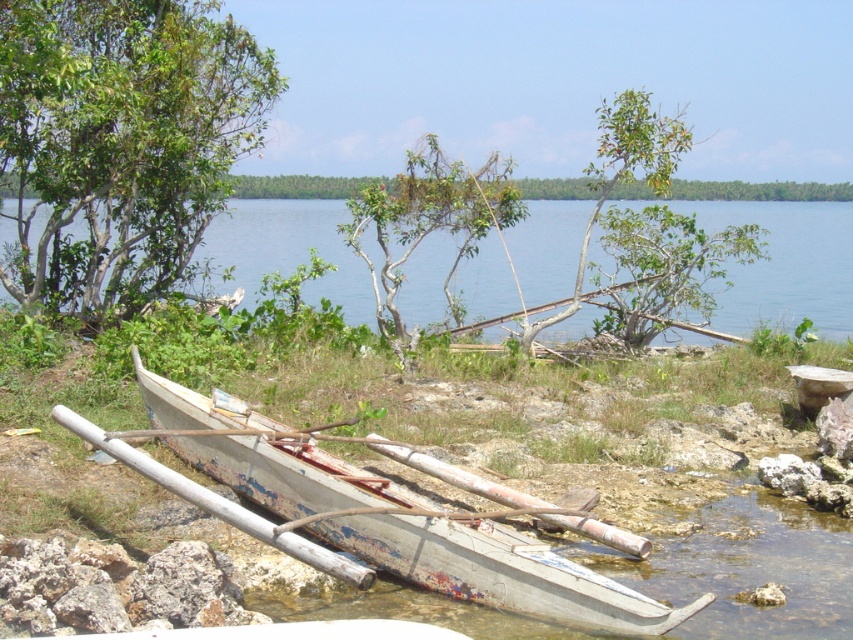
Question: Which point appears closest to the camera in this image?

Choices:
 (A) (96, 97)
 (B) (244, 275)

Answer: (A)

Question: From the image, what is the correct spatial relationship of green leafy tree at upper left in relation to blue water at center?

Choices:
 (A) right
 (B) left

Answer: (B)

Question: Estimate the real-world distances between objects in this image. Which object is closer to the white wooden boat at lower center?

Choices:
 (A) green leafy tree at center
 (B) green leafy tree at upper left

Answer: (B)

Question: Does green leafy tree at upper left have a greater width compared to green leafy tree at center?

Choices:
 (A) no
 (B) yes

Answer: (B)

Question: Is blue water at center in front of white wooden boat at lower center?

Choices:
 (A) yes
 (B) no

Answer: (B)

Question: Among these objects, which one is farthest from the camera?

Choices:
 (A) green leafy tree at upper left
 (B) green leafy tree at center
 (C) blue water at center
 (D) white wooden boat at lower center

Answer: (C)